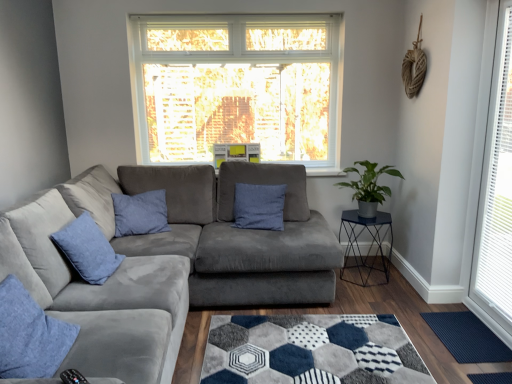
Question: Considering the relative positions of blue velvet pillow at left, acting as the 2th pillow starting from the front, and green matte plant at right in the image provided, is blue velvet pillow at left, acting as the 2th pillow starting from the front, to the right of green matte plant at right from the viewer's perspective?

Choices:
 (A) no
 (B) yes

Answer: (A)

Question: From the image's perspective, is blue velvet pillow at left, acting as the 2th pillow starting from the front, on green matte plant at right?

Choices:
 (A) no
 (B) yes

Answer: (A)

Question: Is blue velvet pillow at left, acting as the 2th pillow starting from the front, completely or partially outside of green matte plant at right?

Choices:
 (A) yes
 (B) no

Answer: (A)

Question: Is blue velvet pillow at left, acting as the 2th pillow starting from the back, bigger than green matte plant at right?

Choices:
 (A) yes
 (B) no

Answer: (B)

Question: From a real-world perspective, is blue velvet pillow at left, the 3th pillow when ordered from right to left, on green matte plant at right?

Choices:
 (A) no
 (B) yes

Answer: (A)

Question: In the image, is metallic blue cocktail table at right positioned in front of or behind white plastic window at right?

Choices:
 (A) front
 (B) behind

Answer: (B)

Question: Choose the correct answer: Is metallic blue cocktail table at right inside white plastic window at right or outside it?

Choices:
 (A) outside
 (B) inside

Answer: (A)

Question: From a real-world perspective, is metallic blue cocktail table at right above or below white plastic window at right?

Choices:
 (A) below
 (B) above

Answer: (A)

Question: In terms of size, does metallic blue cocktail table at right appear bigger or smaller than white plastic window at right?

Choices:
 (A) small
 (B) big

Answer: (B)

Question: Is suede gray couch at center wider or thinner than denim cushion at lower left, the 3th pillow in the back-to-front sequence?

Choices:
 (A) wide
 (B) thin

Answer: (A)

Question: Considering the relative positions of suede gray couch at center and denim cushion at lower left, the 3th pillow in the back-to-front sequence, in the image provided, is suede gray couch at center to the left or to the right of denim cushion at lower left, the 3th pillow in the back-to-front sequence,?

Choices:
 (A) left
 (B) right

Answer: (B)

Question: Considering their positions, is suede gray couch at center located in front of or behind denim cushion at lower left, marked as the second pillow in a left-to-right arrangement?

Choices:
 (A) front
 (B) behind

Answer: (A)

Question: From their relative heights in the image, would you say suede gray couch at center is taller or shorter than denim cushion at lower left, the first pillow positioned from the front?

Choices:
 (A) tall
 (B) short

Answer: (A)

Question: From a real-world perspective, is white plastic window at right physically located above or below green matte plant at right?

Choices:
 (A) above
 (B) below

Answer: (A)

Question: Considering their positions, is white plastic window at right located in front of or behind green matte plant at right?

Choices:
 (A) behind
 (B) front

Answer: (B)